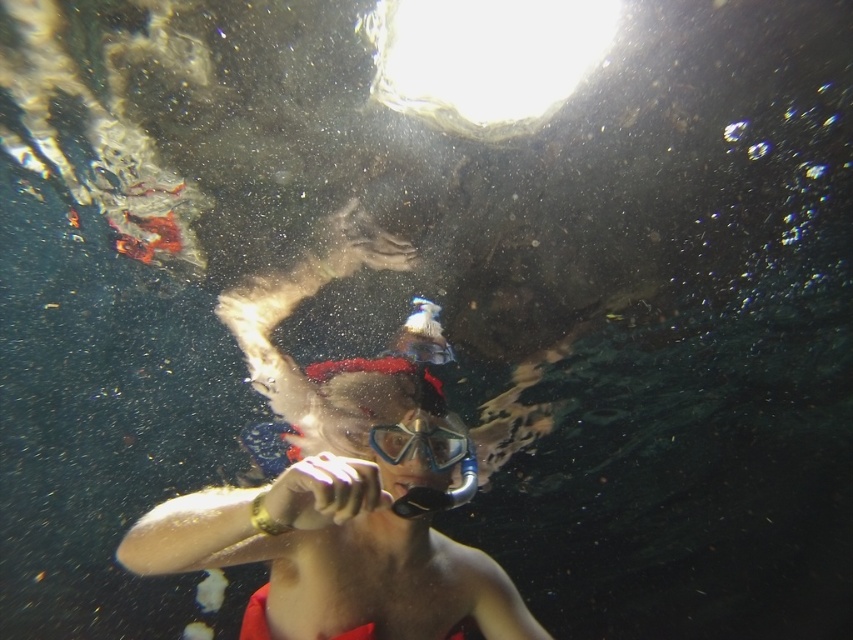
Question: Is transparent water at top below transparent rubber goggles at center?

Choices:
 (A) no
 (B) yes

Answer: (A)

Question: Can you confirm if transparent water at top is positioned to the left of transparent rubber goggles at center?

Choices:
 (A) no
 (B) yes

Answer: (A)

Question: Which object is closer to the camera taking this photo?

Choices:
 (A) transparent water at top
 (B) transparent rubber goggles at center

Answer: (B)

Question: Observing the image, what is the correct spatial positioning of transparent water at top in reference to transparent rubber goggles at center?

Choices:
 (A) above
 (B) below

Answer: (A)

Question: Which of the following is the closest to the observer?

Choices:
 (A) (598, 42)
 (B) (390, 445)

Answer: (B)